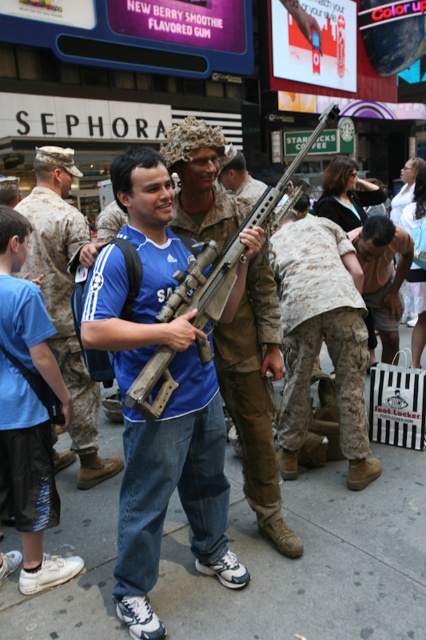
Can you confirm if gray concrete pavement at center is bigger than black mesh shorts at lower left?

Indeed, gray concrete pavement at center has a larger size compared to black mesh shorts at lower left.

Can you confirm if gray concrete pavement at center is wider than black mesh shorts at lower left?

Yes, gray concrete pavement at center is wider than black mesh shorts at lower left.

Who is more forward, (417, 538) or (42, 332)?

Point (42, 332) is more forward.

Find the location of a particular element. This screenshot has width=426, height=640. gray concrete pavement at center is located at coordinates (310, 561).

Consider the image. Who is more distant from viewer, (252, 620) or (48, 316)?

Point (48, 316)

Consider the image. Is gray concrete pavement at center bigger than matte blue shirt at center?

Yes.

Describe the element at coordinates (310, 561) in the screenshot. I see `gray concrete pavement at center` at that location.

The width and height of the screenshot is (426, 640). What are the coordinates of `gray concrete pavement at center` in the screenshot? It's located at (310, 561).

Describe the element at coordinates (166, 403) in the screenshot. The width and height of the screenshot is (426, 640). I see `matte black rifle at center` at that location.

Measure the distance between matte black rifle at center and camera.

A: matte black rifle at center and camera are 2.13 meters apart from each other.

Find the location of a particular element. matte black rifle at center is located at coordinates (166, 403).

Locate an element on the screen. matte black rifle at center is located at coordinates (166, 403).